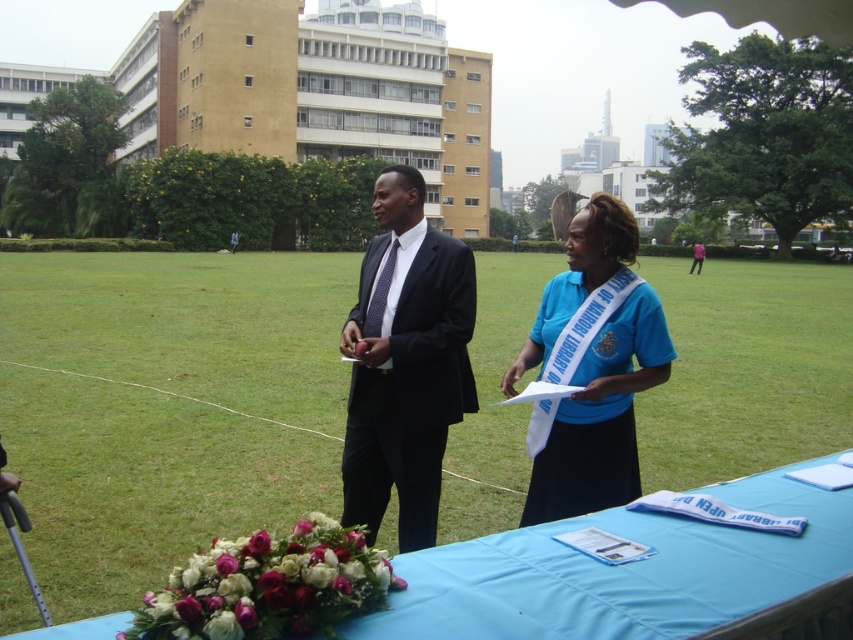
Is point (779, 472) behind point (585, 429)?

No.

Does blue fabric table at center appear on the right side of blue fabric sash at center?

Yes, blue fabric table at center is to the right of blue fabric sash at center.

Is point (669, 604) positioned after point (637, 276)?

No, it is not.

Identify the location of blue fabric table at center. This screenshot has width=853, height=640. point(622,572).

From the picture: Which is more to the left, matte black suit at center or blue fabric sash at center?

matte black suit at center is more to the left.

Does matte black suit at center have a larger size compared to blue fabric sash at center?

Yes.

Is point (419, 195) closer to camera compared to point (636, 376)?

No, (419, 195) is behind (636, 376).

Locate an element on the screen. matte black suit at center is located at coordinates (405, 362).

Is point (722, 614) in front of point (372, 252)?

Yes.

Is blue fabric table at center bigger than matte black suit at center?

Actually, blue fabric table at center might be smaller than matte black suit at center.

Where is `blue fabric table at center`? This screenshot has height=640, width=853. blue fabric table at center is located at coordinates (622, 572).